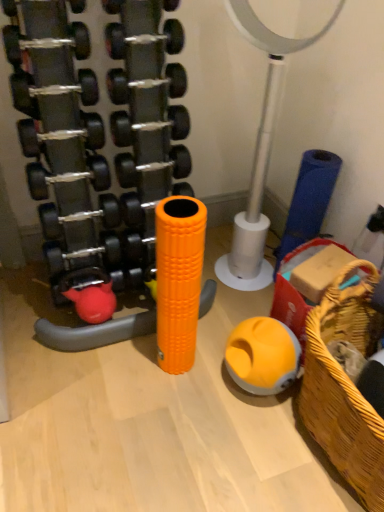
This screenshot has height=512, width=384. Find the location of `free space that is to the left of orange foam roller at center, marked as the first toy in a left-to-right arrangement`. free space that is to the left of orange foam roller at center, marked as the first toy in a left-to-right arrangement is located at coordinates (134, 360).